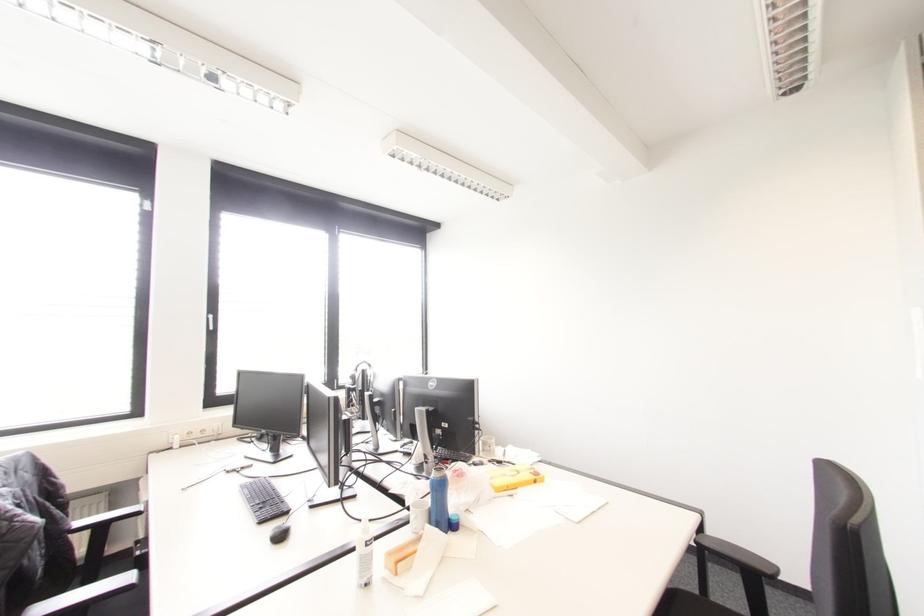
This screenshot has width=924, height=616. Identify the location of black chair sitting surface. (695, 604).